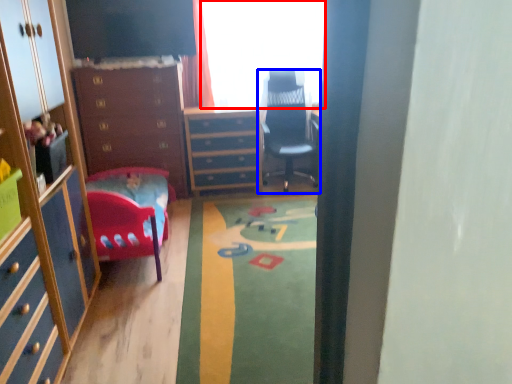
Question: Among these objects, which one is farthest to the camera, window (highlighted by a red box) or chair (highlighted by a blue box)?

Choices:
 (A) window
 (B) chair

Answer: (A)